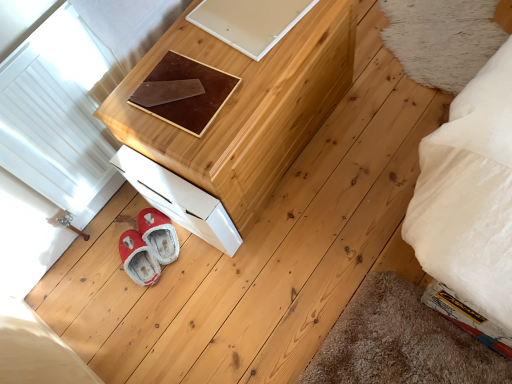
At what (x,y) coordinates should I click in order to perform the action: click on vacant area that is situated to the right of brown leather pad at center. Please return your answer as a coordinate pair (x, y). Image resolution: width=512 pixels, height=384 pixels. Looking at the image, I should click on (244, 65).